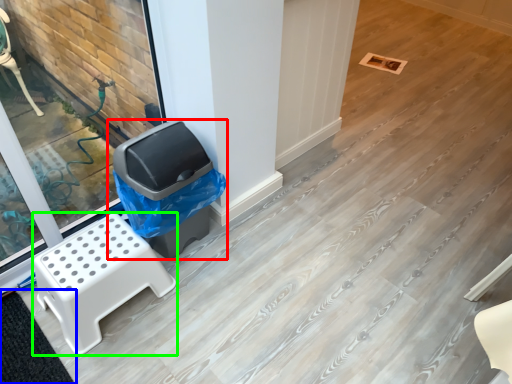
Question: Which object is the farthest from waste container (highlighted by a red box)? Choose among these: mat (highlighted by a blue box) or furniture (highlighted by a green box).

Choices:
 (A) mat
 (B) furniture

Answer: (A)